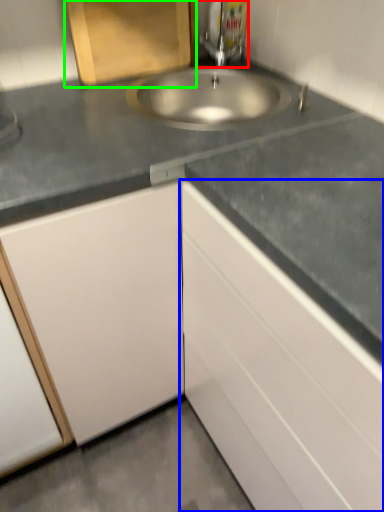
Question: Which is nearer to the tap (highlighted by a red box)? cabinetry (highlighted by a blue box) or cabinetry (highlighted by a green box).

Choices:
 (A) cabinetry
 (B) cabinetry

Answer: (B)